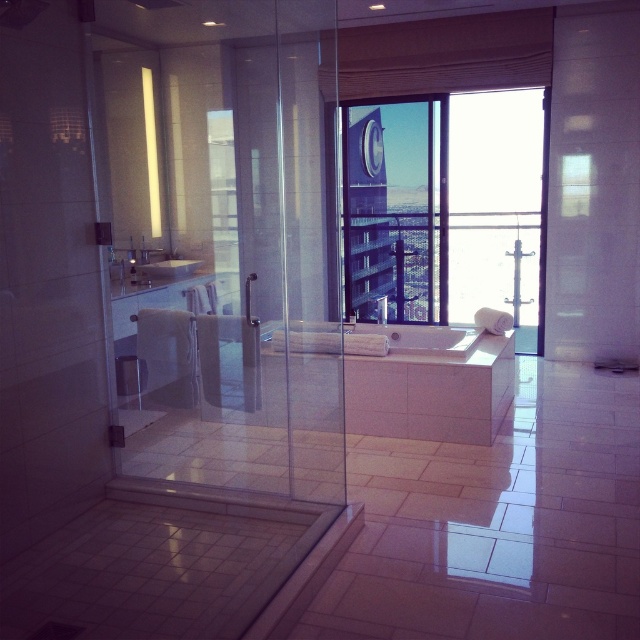
Question: Is transparent glass screen door at left to the left of white glossy sink at center from the viewer's perspective?

Choices:
 (A) yes
 (B) no

Answer: (B)

Question: Which of the following is the closest to the observer?

Choices:
 (A) white glossy sink at center
 (B) transparent glass window at center
 (C) white glossy bathtub at center

Answer: (C)

Question: Is white glossy bathtub at center further to the viewer compared to white glossy sink at center?

Choices:
 (A) yes
 (B) no

Answer: (B)

Question: Which object appears closest to the camera in this image?

Choices:
 (A) white glossy sink at center
 (B) transparent glass screen door at left
 (C) white glossy bathtub at center
 (D) transparent glass window at center

Answer: (B)

Question: Is transparent glass screen door at left bigger than white glossy bathtub at center?

Choices:
 (A) no
 (B) yes

Answer: (B)

Question: Which point is farther from the camera taking this photo?

Choices:
 (A) [396, 250]
 (B) [440, 332]
 (C) [152, 275]

Answer: (A)